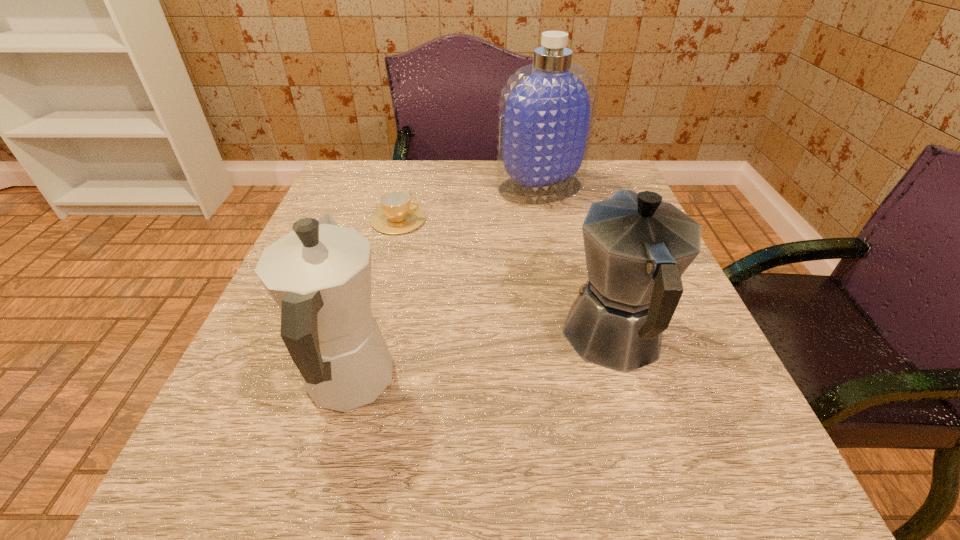
Image resolution: width=960 pixels, height=540 pixels. I want to click on free spot between the right coffeepot and the left coffeepot, so click(482, 361).

This screenshot has width=960, height=540. Identify the location of free area in between the left coffeepot and the cup. (373, 301).

I want to click on empty location between the cup and the right coffeepot, so click(x=506, y=279).

Where is `blank region between the tallest object and the right coffeepot`? The width and height of the screenshot is (960, 540). blank region between the tallest object and the right coffeepot is located at coordinates (577, 262).

This screenshot has height=540, width=960. Find the location of `vacant space in between the shortest object and the left coffeepot`. vacant space in between the shortest object and the left coffeepot is located at coordinates (373, 301).

Identify the location of object that is the closest to the left coffeepot. (637, 247).

The width and height of the screenshot is (960, 540). Find the location of `object that stands as the second closest to the left coffeepot`. object that stands as the second closest to the left coffeepot is located at coordinates click(397, 215).

Image resolution: width=960 pixels, height=540 pixels. Find the location of `free space that satisfies the following two spatial constraints: 1. at the spout of the right coffeepot; 2. with the handle on the side of the shortest object`. free space that satisfies the following two spatial constraints: 1. at the spout of the right coffeepot; 2. with the handle on the side of the shortest object is located at coordinates (579, 220).